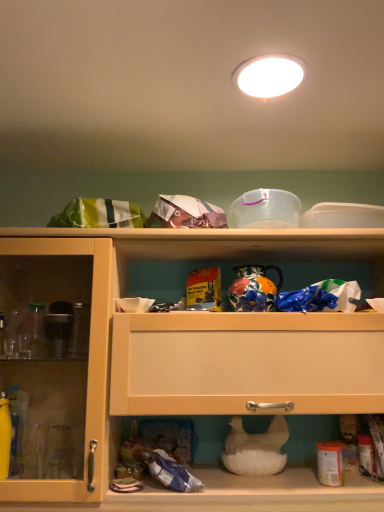
Question: Is white glossy light fixture at upper center situated inside matte wood cabinet at upper center or outside?

Choices:
 (A) outside
 (B) inside

Answer: (A)

Question: In the image, is white glossy light fixture at upper center on the left side or the right side of matte wood cabinet at upper center?

Choices:
 (A) right
 (B) left

Answer: (A)

Question: Considering the positions of white glossy light fixture at upper center and matte wood cabinet at upper center in the image, is white glossy light fixture at upper center bigger or smaller than matte wood cabinet at upper center?

Choices:
 (A) small
 (B) big

Answer: (A)

Question: Relative to white glossy light fixture at upper center, is matte wood cabinet at upper center in front or behind?

Choices:
 (A) behind
 (B) front

Answer: (A)

Question: Considering the positions of point tap(167, 388) and point tap(258, 88), is point tap(167, 388) closer or farther from the camera than point tap(258, 88)?

Choices:
 (A) closer
 (B) farther

Answer: (B)

Question: Would you say matte wood cabinet at upper center is inside or outside white glossy light fixture at upper center?

Choices:
 (A) outside
 (B) inside

Answer: (A)

Question: Is matte wood cabinet at upper center to the left or to the right of white glossy light fixture at upper center in the image?

Choices:
 (A) left
 (B) right

Answer: (A)